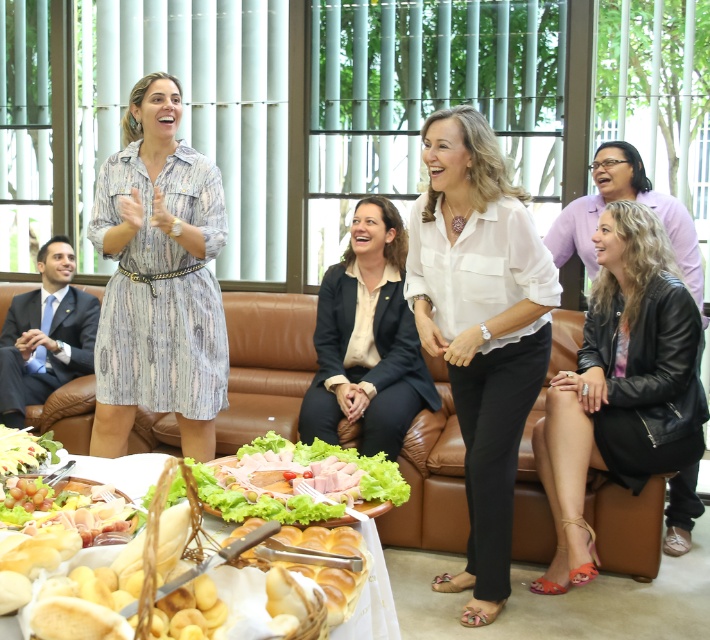
You are a guest at the event and want to take a photo of the white satin blouse at center. Where should you position yourself to capture it in the center of your camera frame?

To capture the white satin blouse at center in the center of your camera frame, position yourself directly in front of it at the coordinates specified by the 2D location point (x=480, y=326).

You are a guest at the event and want to grab a piece of white glossy bread at lower left. However, you are currently sitting on the brown leather couch at center. Can you easily reach the bread without getting up?

The brown leather couch at center is positioned over white glossy bread at lower left, meaning the couch is blocking direct access to the bread. You would need to get up to reach it.